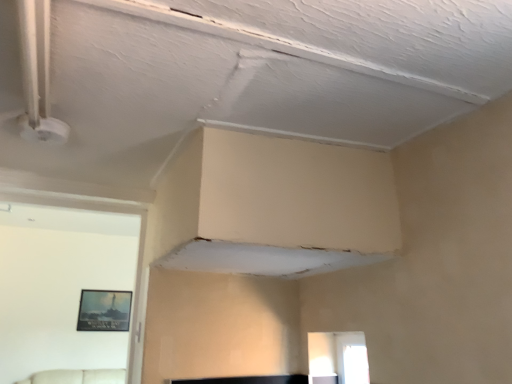
Question: Is transparent glass window at lower right smaller than matte black picture frame at left?

Choices:
 (A) no
 (B) yes

Answer: (A)

Question: Is matte black picture frame at left completely or partially inside transparent glass window at lower right?

Choices:
 (A) no
 (B) yes

Answer: (A)

Question: Is transparent glass window at lower right oriented away from matte black picture frame at left?

Choices:
 (A) no
 (B) yes

Answer: (A)

Question: Can you confirm if transparent glass window at lower right is positioned to the right of matte black picture frame at left?

Choices:
 (A) yes
 (B) no

Answer: (A)

Question: From the image's perspective, is transparent glass window at lower right beneath matte black picture frame at left?

Choices:
 (A) yes
 (B) no

Answer: (B)

Question: From a real-world perspective, is transparent glass window at lower right positioned under matte black picture frame at left based on gravity?

Choices:
 (A) yes
 (B) no

Answer: (A)

Question: Does matte black picture frame at left have a smaller size compared to transparent glass window at lower right?

Choices:
 (A) no
 (B) yes

Answer: (B)

Question: Does matte black picture frame at left have a lesser height compared to transparent glass window at lower right?

Choices:
 (A) yes
 (B) no

Answer: (B)

Question: Is matte black picture frame at left to the right of transparent glass window at lower right from the viewer's perspective?

Choices:
 (A) yes
 (B) no

Answer: (B)

Question: Does matte black picture frame at left have a lesser width compared to transparent glass window at lower right?

Choices:
 (A) no
 (B) yes

Answer: (B)

Question: Can we say matte black picture frame at left lies outside transparent glass window at lower right?

Choices:
 (A) no
 (B) yes

Answer: (B)

Question: Is matte black picture frame at left positioned in front of transparent glass window at lower right?

Choices:
 (A) no
 (B) yes

Answer: (A)

Question: From the image's perspective, is transparent glass window at lower right located above or below matte black picture frame at left?

Choices:
 (A) above
 (B) below

Answer: (A)